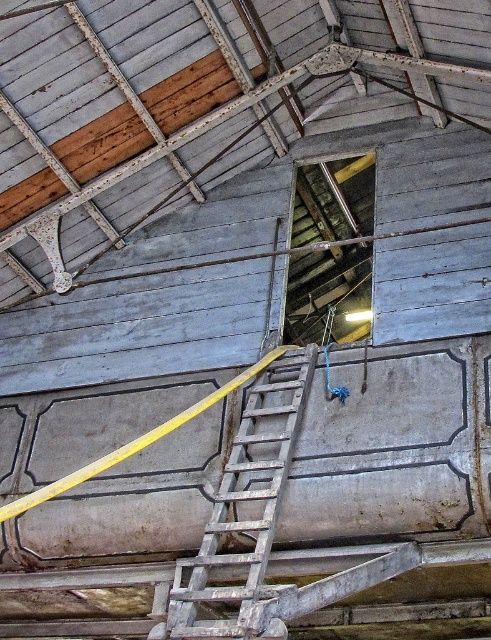
You are a maintenance worker needing to inspect the rusty metal roof at upper center. The wooden ladder at center is your only access. Is the ladder positioned correctly to reach the roof?

Yes, the ladder is positioned correctly because the rusty metal roof at upper center is located above the wooden ladder at center, meaning the ladder leads directly to the roof.

You are an inspector checking the structural integrity of this old industrial building. You notice the wooden ladder at center and the wooden at upper center. Which object is narrower in width?

The wooden ladder at center is narrower in width compared to the wooden at upper center.

You are an inspector checking the structural integrity of this old industrial building. You notice the rusty metal roof at upper center and the wooden at upper center. Which one is located above the other?

The rusty metal roof at upper center is positioned over the wooden at upper center, meaning it is above it.